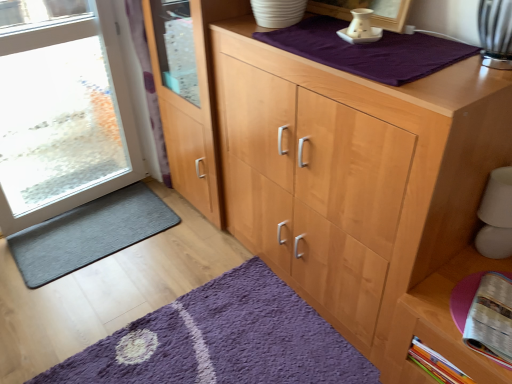
The width and height of the screenshot is (512, 384). Describe the element at coordinates (362, 189) in the screenshot. I see `light wood cupboard at center` at that location.

Where is `transparent glass door at left`? transparent glass door at left is located at coordinates (63, 118).

What is the approximate width of dark gray textured mat at lower left, the first doormat viewed from the back?

18.69 inches.

Locate an element on the screen. This screenshot has width=512, height=384. purple shaggy rug at lower center, which is the second doormat from top to bottom is located at coordinates (222, 340).

What are the coordinates of `clear glass door at left` in the screenshot? It's located at (185, 102).

You are a GUI agent. You are given a task and a screenshot of the screen. Output one action in this format:
    pyautogui.click(x=<x>, y=<y>)
    Task: Click on the light wood cupboard at center
    
    Given the screenshot: What is the action you would take?
    pyautogui.click(x=362, y=189)

Is printed paper magazine at lower right positioned beyond the bounds of purple cotton blanket at upper center?

Indeed, printed paper magazine at lower right is completely outside purple cotton blanket at upper center.

How far apart are printed paper magazine at lower right and purple cotton blanket at upper center?

printed paper magazine at lower right and purple cotton blanket at upper center are 29.52 inches apart.

Is purple cotton blanket at upper center at the back of printed paper magazine at lower right?

No, printed paper magazine at lower right is not facing away from purple cotton blanket at upper center.

Is printed paper magazine at lower right placed right next to purple cotton blanket at upper center?

printed paper magazine at lower right is not next to purple cotton blanket at upper center, and they're not touching.

Is there a large distance between wooden cabinet at lower right and clear glass door at left?

That's right, there is a large distance between wooden cabinet at lower right and clear glass door at left.

Can you confirm if wooden cabinet at lower right is taller than clear glass door at left?

In fact, wooden cabinet at lower right may be shorter than clear glass door at left.

Is wooden cabinet at lower right facing towards clear glass door at left?

No, wooden cabinet at lower right is not aimed at clear glass door at left.

Which is more to the right, wooden cabinet at lower right or dark gray textured mat at lower left, the first doormat viewed from the back?

From the viewer's perspective, wooden cabinet at lower right appears more on the right side.

From a real-world perspective, which doormat is the 1st one underneath the wooden cabinet at lower right? Please provide its 2D coordinates.

[(89, 233)]

From the image's perspective, does wooden cabinet at lower right appear lower than dark gray textured mat at lower left, the first doormat viewed from the back?

Yes, from the image's perspective, wooden cabinet at lower right is below dark gray textured mat at lower left, the first doormat viewed from the back.

Could you tell me if wooden cabinet at lower right is turned towards dark gray textured mat at lower left, the 2th doormat from the bottom?

No, wooden cabinet at lower right is not oriented towards dark gray textured mat at lower left, the 2th doormat from the bottom.

Who is more distant, transparent glass door at left or dark gray textured mat at lower left, which is counted as the second doormat, starting from the front?

dark gray textured mat at lower left, which is counted as the second doormat, starting from the front.

Between point (3, 131) and point (47, 255), which one is positioned in front?

Point (3, 131)

Does transparent glass door at left appear on the left side of dark gray textured mat at lower left, the first doormat viewed from the back?

Yes, transparent glass door at left is to the left of dark gray textured mat at lower left, the first doormat viewed from the back.

From a real-world perspective, which object rests below the other?

dark gray textured mat at lower left, the 1th doormat positioned from the top, is physically lower.

Looking at this image, from the image's perspective, which one is positioned lower, light wood cupboard at center or printed paper magazine at lower right?

printed paper magazine at lower right, from the image's perspective.

Is light wood cupboard at center taller than printed paper magazine at lower right?

Yes, light wood cupboard at center is taller than printed paper magazine at lower right.

How many degrees apart are the facing directions of light wood cupboard at center and printed paper magazine at lower right?

There is a 19.9-degree angle between the facing directions of light wood cupboard at center and printed paper magazine at lower right.

Which of these two, light wood cupboard at center or printed paper magazine at lower right, is thinner?

printed paper magazine at lower right is thinner.

Which of these two, transparent glass door at left or light wood cupboard at center, stands taller?

transparent glass door at left is taller.

The width and height of the screenshot is (512, 384). In the image, there is a light wood cupboard at center. Find the location of `door above it (from the image's perspective)`. door above it (from the image's perspective) is located at coordinates (63, 118).

Looking at this image, is transparent glass door at left at the left side of light wood cupboard at center?

Correct, you'll find transparent glass door at left to the left of light wood cupboard at center.

Considering the positions of point (103, 169) and point (307, 130), is point (103, 169) closer or farther from the camera than point (307, 130)?

Point (103, 169) appears to be farther away from the viewer than point (307, 130).

Choose the correct answer: Is transparent glass door at left inside printed paper magazine at lower right or outside it?

transparent glass door at left cannot be found inside printed paper magazine at lower right.

Does transparent glass door at left have a greater height compared to printed paper magazine at lower right?

Correct, transparent glass door at left is much taller as printed paper magazine at lower right.

Which of these two, transparent glass door at left or printed paper magazine at lower right, is wider?

printed paper magazine at lower right.

From a real-world perspective, is transparent glass door at left located higher than printed paper magazine at lower right?

Yes, from a real-world perspective, transparent glass door at left is above printed paper magazine at lower right.

Locate an element on the screen. This screenshot has width=512, height=384. blanket above the printed paper magazine at lower right (from the image's perspective) is located at coordinates (368, 50).

Image resolution: width=512 pixels, height=384 pixels. Find the location of `screen door behind the wooden cabinet at lower right`. screen door behind the wooden cabinet at lower right is located at coordinates (185, 102).

Estimate the real-world distances between objects in this image. Which object is closer to wooden cabinet at lower right, dark gray textured mat at lower left, the 1th doormat positioned from the top, or printed paper magazine at lower right?

Based on the image, printed paper magazine at lower right appears to be nearer to wooden cabinet at lower right.

Looking at the image, which one is located closer to light wood cupboard at center, transparent glass door at left or purple shaggy rug at lower center, which is the second doormat from top to bottom?

purple shaggy rug at lower center, which is the second doormat from top to bottom, is positioned closer to the anchor light wood cupboard at center.

Based on their spatial positions, is printed paper magazine at lower right or purple shaggy rug at lower center, which is the second doormat in back-to-front order, further from transparent glass door at left?

printed paper magazine at lower right is further to transparent glass door at left.

When comparing their distances from dark gray textured mat at lower left, the 1th doormat positioned from the top, does purple shaggy rug at lower center, the 1th doormat positioned from the front, or printed paper magazine at lower right seem closer?

The object closer to dark gray textured mat at lower left, the 1th doormat positioned from the top, is purple shaggy rug at lower center, the 1th doormat positioned from the front.

Estimate the real-world distances between objects in this image. Which object is further from printed paper magazine at lower right, purple shaggy rug at lower center, which is the second doormat in back-to-front order, or wooden cabinet at lower right?

Among the two, purple shaggy rug at lower center, which is the second doormat in back-to-front order, is located further to printed paper magazine at lower right.

Based on their spatial positions, is transparent glass door at left or dark gray textured mat at lower left, the 2th doormat from the bottom, further from wooden cabinet at lower right?

transparent glass door at left.

From the image, which object appears to be nearer to printed paper magazine at lower right, transparent glass door at left or wooden cabinet at lower right?

The object closer to printed paper magazine at lower right is wooden cabinet at lower right.

Looking at the image, which one is located closer to dark gray textured mat at lower left, the 1th doormat positioned from the top, clear glass door at left or purple shaggy rug at lower center, which is the second doormat in back-to-front order?

Among the two, clear glass door at left is located nearer to dark gray textured mat at lower left, the 1th doormat positioned from the top.

I want to click on magazine located between clear glass door at left and wooden cabinet at lower right in the left-right direction, so click(490, 319).

Identify the location of blanket between clear glass door at left and light wood cupboard at center from left to right. (368, 50).

This screenshot has height=384, width=512. What are the coordinates of `screen door between dark gray textured mat at lower left, the first doormat viewed from the back, and light wood cupboard at center` in the screenshot? It's located at (185, 102).

Where is `screen door between transparent glass door at left and purple cotton blanket at upper center in the horizontal direction`? screen door between transparent glass door at left and purple cotton blanket at upper center in the horizontal direction is located at coordinates (185, 102).